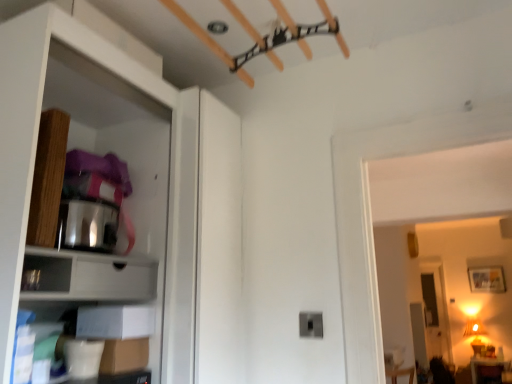
Question: Does matte black drawer at lower left have a greater height compared to matte white cabinet at left?

Choices:
 (A) no
 (B) yes

Answer: (A)

Question: Is matte black drawer at lower left turned away from matte white cabinet at left?

Choices:
 (A) yes
 (B) no

Answer: (A)

Question: Considering the relative sizes of matte black drawer at lower left and matte white cabinet at left in the image provided, is matte black drawer at lower left smaller than matte white cabinet at left?

Choices:
 (A) no
 (B) yes

Answer: (B)

Question: Considering the relative sizes of matte black drawer at lower left and matte white cabinet at left in the image provided, is matte black drawer at lower left thinner than matte white cabinet at left?

Choices:
 (A) no
 (B) yes

Answer: (B)

Question: Is matte black drawer at lower left further to camera compared to matte white cabinet at left?

Choices:
 (A) no
 (B) yes

Answer: (B)

Question: Is matte black drawer at lower left bigger than matte white cabinet at left?

Choices:
 (A) no
 (B) yes

Answer: (A)

Question: Could you tell me if matte black drawer at lower left is turned towards white matte cabinet at lower left?

Choices:
 (A) no
 (B) yes

Answer: (A)

Question: Is matte black drawer at lower left outside white matte cabinet at lower left?

Choices:
 (A) yes
 (B) no

Answer: (A)

Question: Is matte black drawer at lower left further to camera compared to white matte cabinet at lower left?

Choices:
 (A) no
 (B) yes

Answer: (A)

Question: From the image's perspective, would you say matte black drawer at lower left is positioned over white matte cabinet at lower left?

Choices:
 (A) yes
 (B) no

Answer: (A)

Question: Considering the relative sizes of matte black drawer at lower left and white matte cabinet at lower left in the image provided, is matte black drawer at lower left bigger than white matte cabinet at lower left?

Choices:
 (A) yes
 (B) no

Answer: (B)

Question: From a real-world perspective, is matte black drawer at lower left below white matte cabinet at lower left?

Choices:
 (A) yes
 (B) no

Answer: (A)

Question: Is matte white cabinet at left in contact with white matte cabinet at lower left?

Choices:
 (A) yes
 (B) no

Answer: (B)